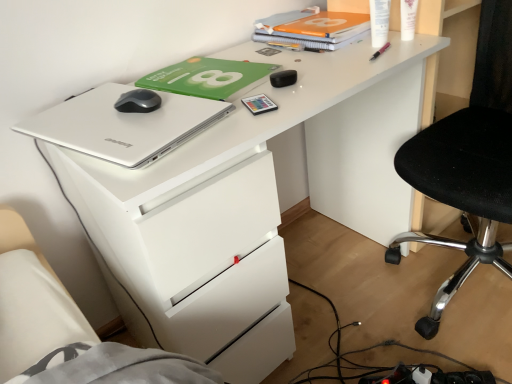
Locate an element on the screen. The width and height of the screenshot is (512, 384). free area in between pink plastic pen at upper right, which is the 3th stationery from bottom to top, and black matte earbuds at center, the second stationery ordered from the bottom is located at coordinates (335, 64).